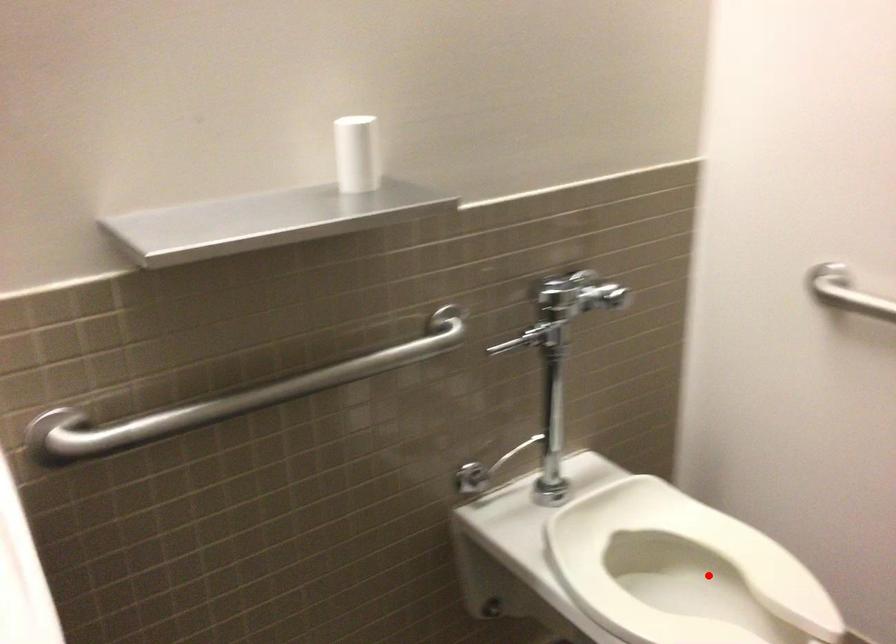
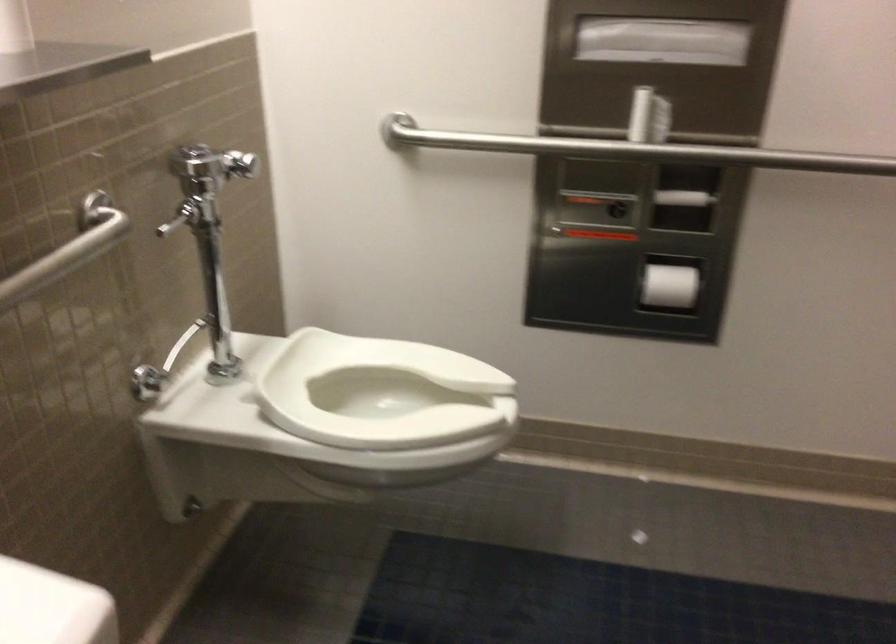
The point at the highlighted location is marked in the first image. Where is the corresponding point in the second image?

(381, 393)